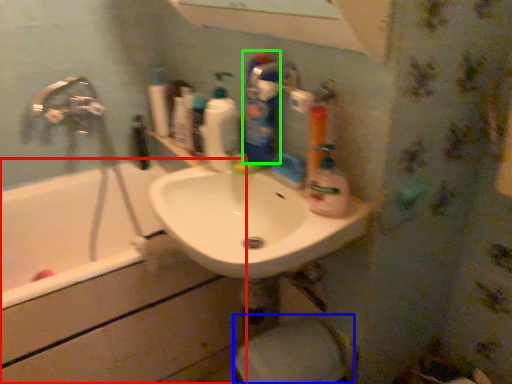
Question: Based on their relative distances, which object is nearer to bath (highlighted by a red box)? Choose from toilet paper (highlighted by a blue box) and cleaning product (highlighted by a green box).

Choices:
 (A) toilet paper
 (B) cleaning product

Answer: (A)